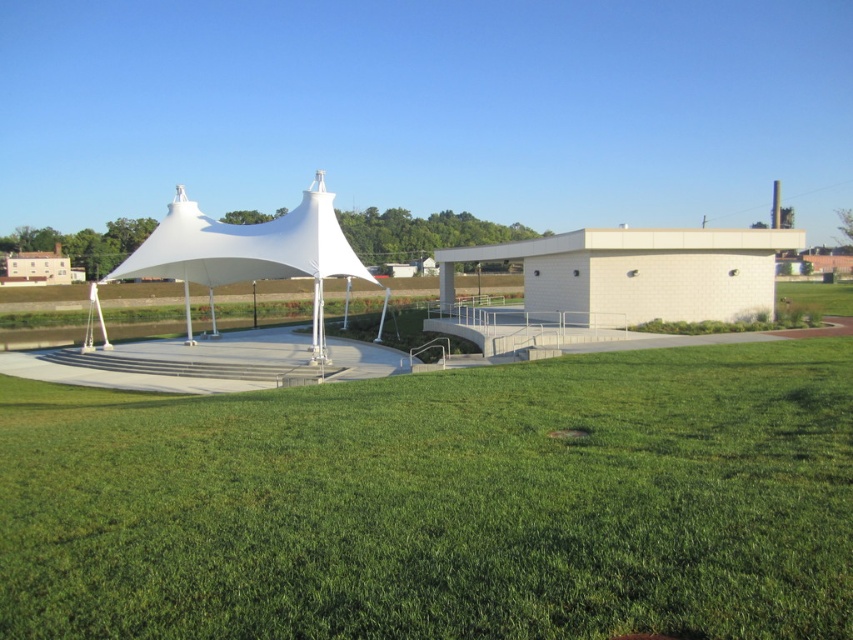
You are planning to set up a temporary food stall for an event. The stall requires a space of 50 feet between the green grass at lower center and the white fabric tent at center. Based on the image, is the available space sufficient for your stall?

The distance between the green grass at lower center and the white fabric tent at center is 66.24 feet, which is more than the required 50 feet. Therefore, the available space is sufficient for the stall.

You are planning to set up a small picnic blanket in the area shown. Considering the green grass at lower center and the white fabric tent at center, which location would be more suitable for placing your picnic blanket?

The green grass at lower center has a smaller size compared to the white fabric tent at center, so the white fabric tent at center would provide a more spacious area for placing the picnic blanket.

You are planning to set up a small garden in the area. Considering the green grass at lower center and the white fabric tent at center, which one is shorter and thus more suitable for placing garden decorations?

The green grass at lower center has a lesser height compared to the white fabric tent at center, so it is shorter and more suitable for placing garden decorations.